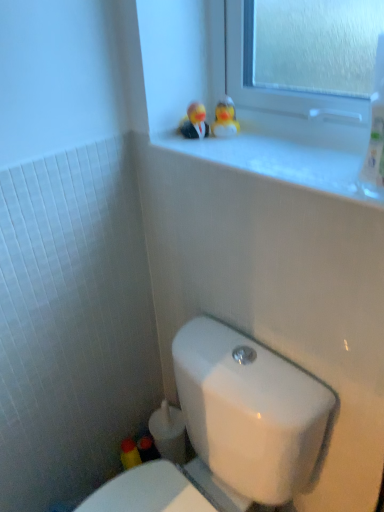
Question: Considering the positions of rubber duck at upper center, the second miniature from the right, and rubber duckies at upper center, which is the first miniature in right-to-left order, in the image, is rubber duck at upper center, the second miniature from the right, wider or thinner than rubber duckies at upper center, which is the first miniature in right-to-left order,?

Choices:
 (A) wide
 (B) thin

Answer: (B)

Question: Is point (183, 123) closer or farther from the camera than point (233, 128)?

Choices:
 (A) farther
 (B) closer

Answer: (A)

Question: Based on their relative distances, which object is farther from the white glossy toilet at lower center?

Choices:
 (A) white glossy window sill at upper center
 (B) rubber duck at upper center, placed as the 1th miniature when sorted from left to right
 (C) rubber duckies at upper center, which is the first miniature in right-to-left order

Answer: (B)

Question: Estimate the real-world distances between objects in this image. Which object is farther from the rubber duck at upper center, placed as the 1th miniature when sorted from left to right?

Choices:
 (A) rubber duckies at upper center, the 2th miniature when ordered from left to right
 (B) white glossy toilet at lower center
 (C) white glossy window sill at upper center

Answer: (B)